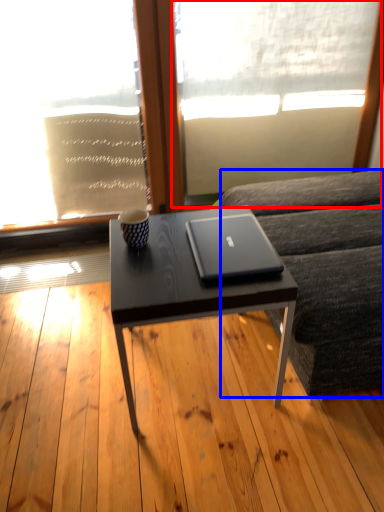
Question: Which object is closer to the camera taking this photo, window screen (highlighted by a red box) or studio couch (highlighted by a blue box)?

Choices:
 (A) window screen
 (B) studio couch

Answer: (B)